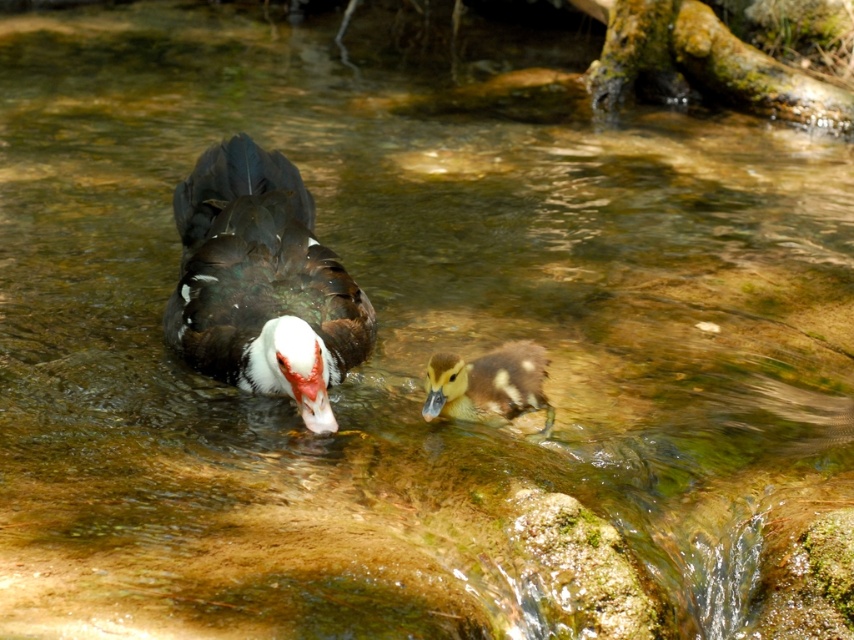
Between black glossy duck at center and brown speckled duckling at center, which one has less height?

With less height is brown speckled duckling at center.

Does point (273, 262) come closer to viewer compared to point (541, 433)?

No, it is behind (541, 433).

I want to click on black glossy duck at center, so click(262, 284).

Find the location of `black glossy duck at center`. black glossy duck at center is located at coordinates (262, 284).